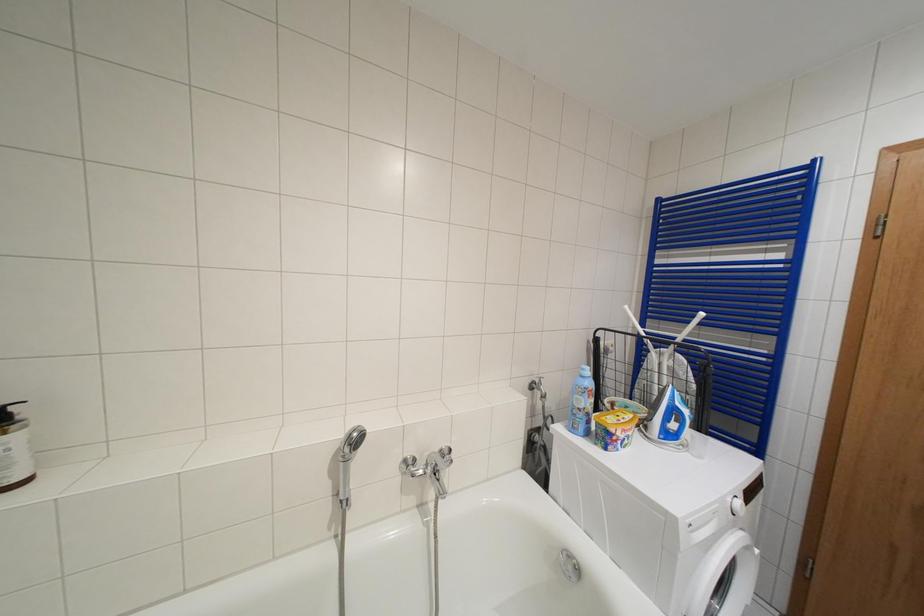
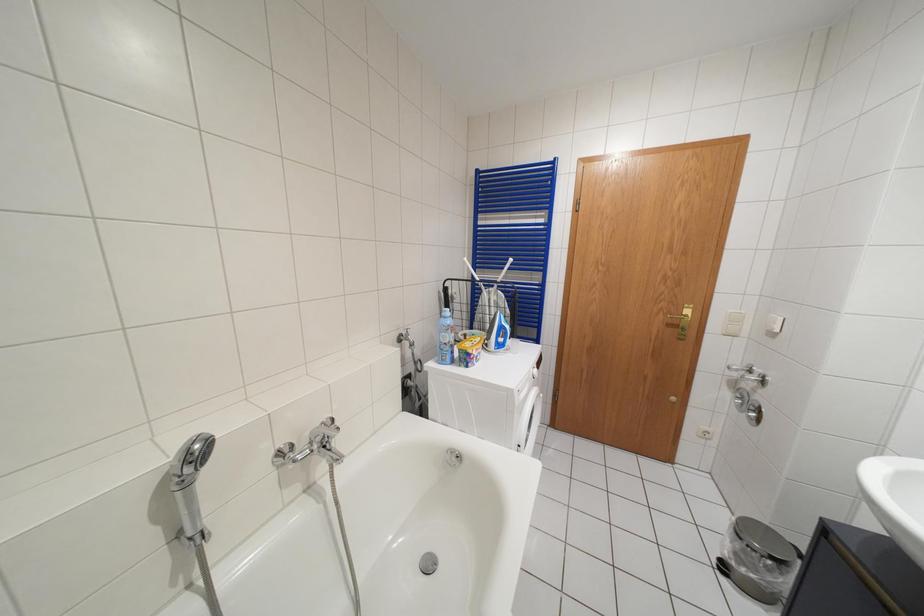
Question: The camera is either moving clockwise (left) or counter-clockwise (right) around the object. The first image is from the beginning of the video and the second image is from the end. Is the camera moving left or right when shooting the video?

Choices:
 (A) Left
 (B) Right

Answer: (A)